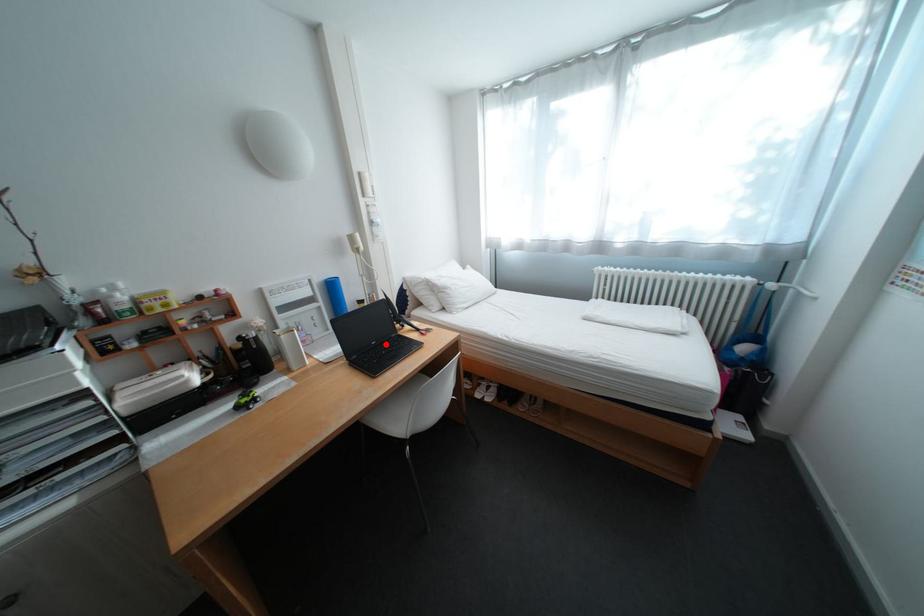
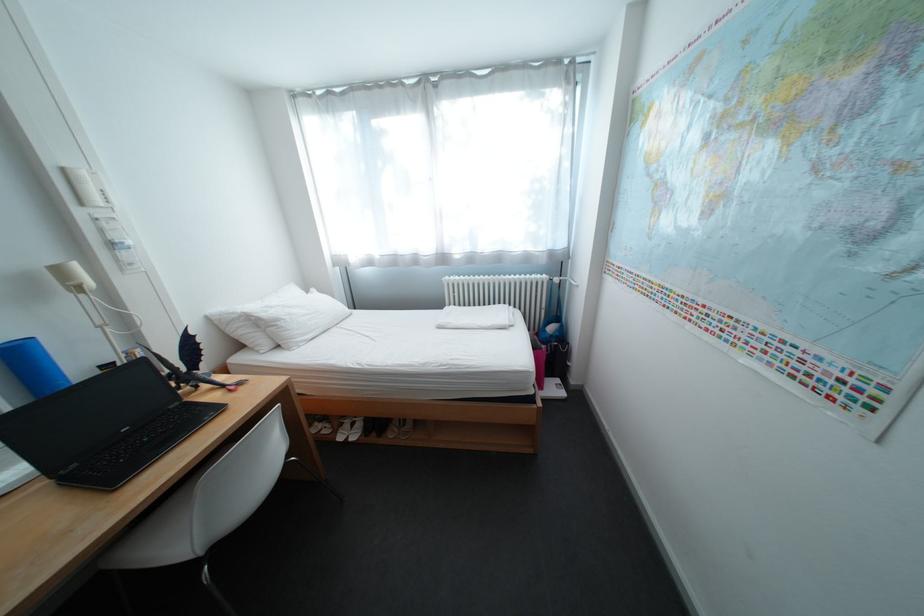
Locate, in the second image, the point that corresponds to the highlighted location in the first image.

(137, 431)